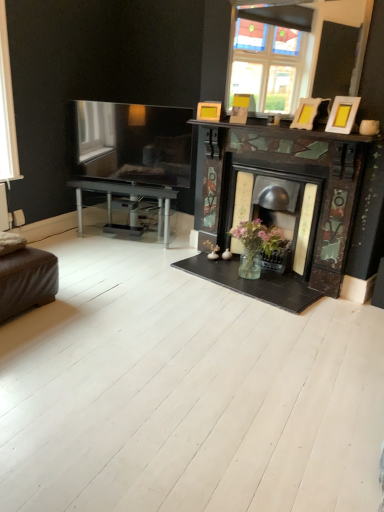
Question: From a real-world perspective, is matte yellow picture frame at upper right, acting as the 3th picture frame starting from the front, physically below wooden photo frame at upper right, which is the 2th picture frame from left to right?

Choices:
 (A) no
 (B) yes

Answer: (A)

Question: Is wooden photo frame at upper right, the 2th picture frame in the front-to-back sequence, completely or partially inside matte yellow picture frame at upper right, marked as the 1th picture frame in a left-to-right arrangement?

Choices:
 (A) no
 (B) yes

Answer: (A)

Question: Considering the relative sizes of matte yellow picture frame at upper right, positioned as the first picture frame in back-to-front order, and wooden photo frame at upper right, positioned as the 2th picture frame in back-to-front order, in the image provided, is matte yellow picture frame at upper right, positioned as the first picture frame in back-to-front order, wider than wooden photo frame at upper right, positioned as the 2th picture frame in back-to-front order,?

Choices:
 (A) no
 (B) yes

Answer: (B)

Question: Are matte yellow picture frame at upper right, positioned as the first picture frame in back-to-front order, and wooden photo frame at upper right, positioned as the 2th picture frame in back-to-front order, far apart?

Choices:
 (A) no
 (B) yes

Answer: (A)

Question: Is the position of matte yellow picture frame at upper right, marked as the 1th picture frame in a left-to-right arrangement, more distant than that of wooden photo frame at upper right, the 2th picture frame in the front-to-back sequence?

Choices:
 (A) yes
 (B) no

Answer: (A)

Question: Relative to wooden photo frame at upper right, positioned as the 2th picture frame in right-to-left order, is brown leather ottoman at lower left in front or behind?

Choices:
 (A) behind
 (B) front

Answer: (B)

Question: From a real-world perspective, is brown leather ottoman at lower left positioned above or below wooden photo frame at upper right, the 2th picture frame in the front-to-back sequence?

Choices:
 (A) above
 (B) below

Answer: (B)

Question: Is point (28, 302) closer or farther from the camera than point (301, 114)?

Choices:
 (A) closer
 (B) farther

Answer: (A)

Question: From their relative heights in the image, would you say brown leather ottoman at lower left is taller or shorter than wooden photo frame at upper right, positioned as the 2th picture frame in back-to-front order?

Choices:
 (A) tall
 (B) short

Answer: (A)

Question: Looking at the image, does wooden photo frame at upper right, positioned as the 2th picture frame in back-to-front order, seem bigger or smaller compared to transparent glass window at left?

Choices:
 (A) big
 (B) small

Answer: (B)

Question: In the image, is wooden photo frame at upper right, positioned as the 2th picture frame in right-to-left order, positioned in front of or behind transparent glass window at left?

Choices:
 (A) behind
 (B) front

Answer: (B)

Question: Considering the positions of wooden photo frame at upper right, positioned as the 2th picture frame in right-to-left order, and transparent glass window at left in the image, is wooden photo frame at upper right, positioned as the 2th picture frame in right-to-left order, wider or thinner than transparent glass window at left?

Choices:
 (A) wide
 (B) thin

Answer: (B)

Question: Is wooden photo frame at upper right, the 2th picture frame in the front-to-back sequence, taller or shorter than transparent glass window at left?

Choices:
 (A) tall
 (B) short

Answer: (B)

Question: From the image's perspective, relative to transparent glass window at left, is matte yellow picture frame at upper right, marked as the 1th picture frame in a left-to-right arrangement, above or below?

Choices:
 (A) below
 (B) above

Answer: (A)

Question: Looking at the image, does matte yellow picture frame at upper right, acting as the 3th picture frame starting from the front, seem bigger or smaller compared to transparent glass window at left?

Choices:
 (A) small
 (B) big

Answer: (A)